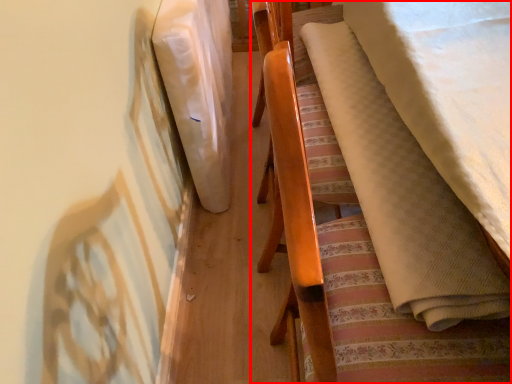
Question: Considering the relative positions of furniture (annotated by the red box) and blanket in the image provided, where is furniture (annotated by the red box) located with respect to the staircase?

Choices:
 (A) right
 (B) left

Answer: (A)